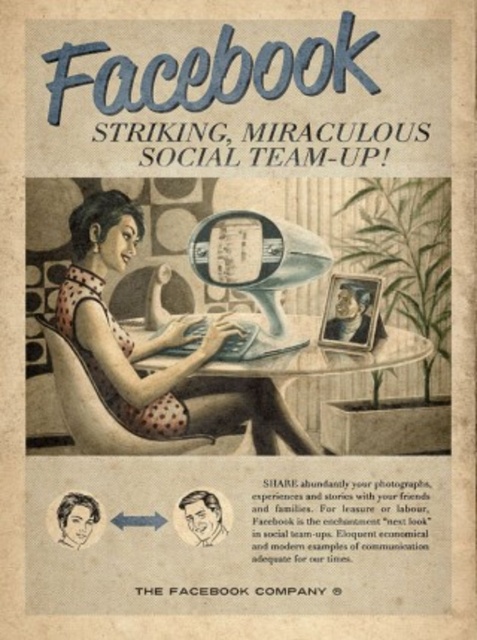
You are an interior designer assessing the vintage Facebook ad scene. You need to determine which object, the polka dot fabric dress at center or the translucent glass table at center, occupies a greater vertical space in the image. Based on the scene description, which one is taller?

The polka dot fabric dress at center is taller than the translucent glass table at center according to the description.

Consider the image. You are standing in front of the vintage Facebook advertisement. There are two points marked on the image. The first point is at coordinates point (87,253) and the second point is at point (247,320). Which of these two points is closer to you?

Point (87,253) is closer to the viewer than point (247,320).

You are an interior designer assessing the vintage Facebook advertisement scene. You need to determine which object occupies more space in the composition between the polka dot fabric dress at center and the translucent glass table at center. Which one is bigger?

The polka dot fabric dress at center is larger in size than the translucent glass table at center, so the dress occupies more space in the composition.